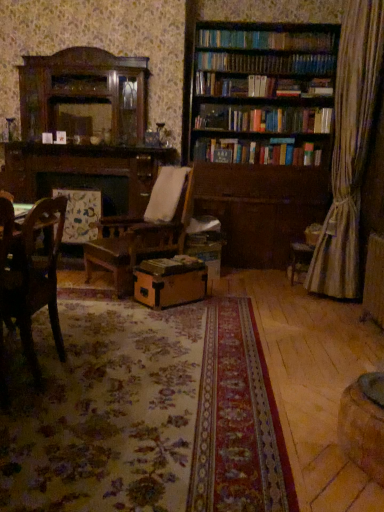
I want to click on vacant area to the right of brown cardboard box at center, so click(226, 302).